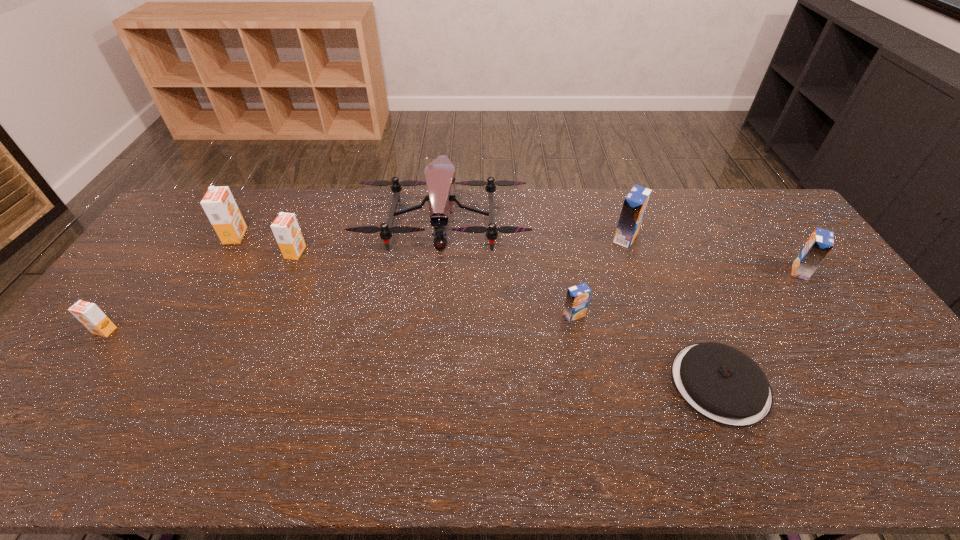
Where is `vacant region between the nearest orange juice and the drone`? vacant region between the nearest orange juice and the drone is located at coordinates (274, 276).

Locate an element on the screen. the fourth closest object relative to the fifth orange juice from left to right is located at coordinates (820, 243).

This screenshot has height=540, width=960. I want to click on the seventh closest object to the fourth orange juice from right to left, so click(x=820, y=243).

Identify which orange juice is the sixth nearest to the pancake. Please provide its 2D coordinates. Your answer should be formatted as a tuple, i.e. [(x, y)], where the tuple contains the x and y coordinates of a point satisfying the conditions above.

[(89, 314)]

Locate an element on the screen. Image resolution: width=960 pixels, height=540 pixels. orange juice that is the nearest to the seventh farthest object is located at coordinates (218, 203).

Locate an element on the screen. This screenshot has height=540, width=960. blue orange_juice that is the closest to the fourth farthest orange juice is located at coordinates (635, 203).

You are a GUI agent. You are given a task and a screenshot of the screen. Output one action in this format:
    pyautogui.click(x=<x>, y=<y>)
    Task: Click on the blue orange_juice object that ranks as the closest to the third orange juice from right to left
    The image size is (960, 540).
    Given the screenshot: What is the action you would take?
    (x=635, y=203)

This screenshot has width=960, height=540. What are the coordinates of `orange orange juice that is the third closest one to the second blue orange_juice from left to right` in the screenshot? It's located at (89, 314).

The height and width of the screenshot is (540, 960). I want to click on the closest orange orange juice to the second orange juice from right to left, so click(286, 230).

In order to click on free space that satisfies the following two spatial constraints: 1. on the front-facing side of the drone; 2. on the left side of the fifth farthest orange juice in this screenshot , I will do [434, 315].